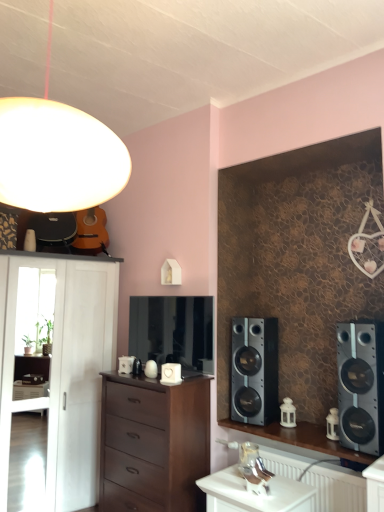
You are a GUI agent. You are given a task and a screenshot of the screen. Output one action in this format:
    pyautogui.click(x=<x>, y=<y>)
    Task: Click on the free location to the right of white porcelain lantern at center
    The width and height of the screenshot is (384, 512).
    Given the screenshot: What is the action you would take?
    pyautogui.click(x=306, y=420)